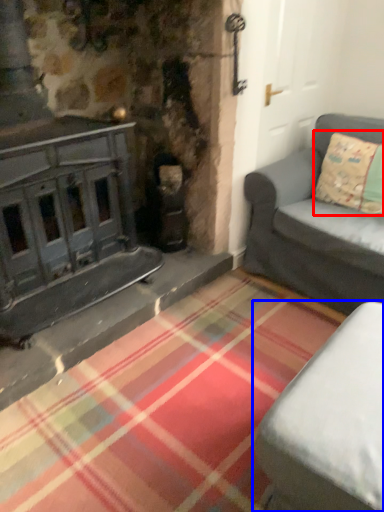
Question: Which object is closer to the camera taking this photo, pillow (highlighted by a red box) or studio couch (highlighted by a blue box)?

Choices:
 (A) pillow
 (B) studio couch

Answer: (B)